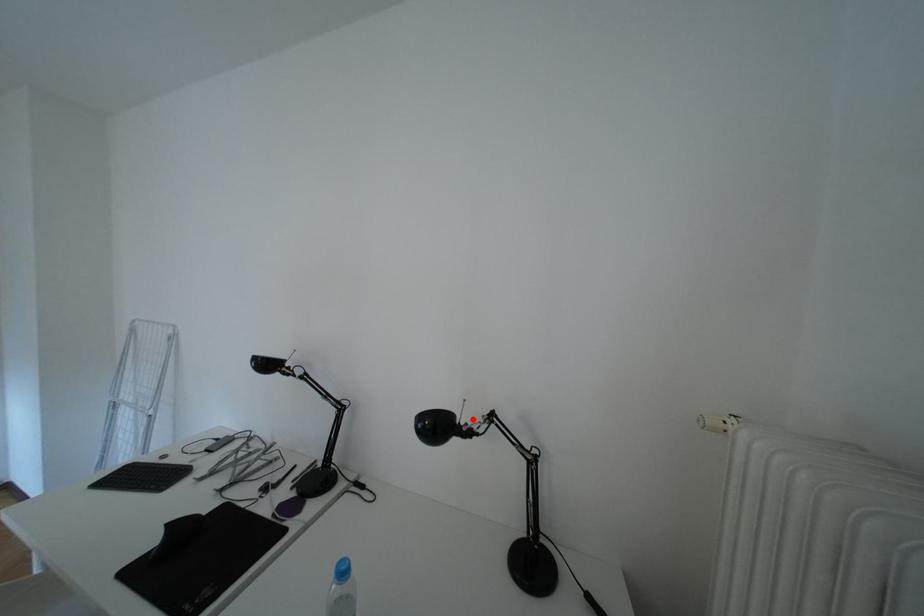
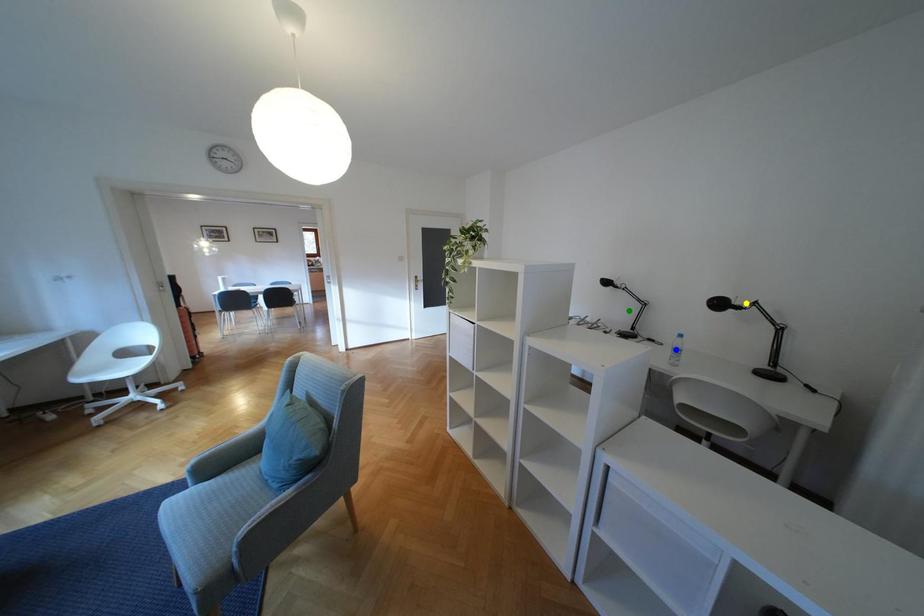
Question: I am providing you with two images of the same scene from different viewpoints. A red point is marked on the first image. You are given multiple points on the second image. Which mark in image 2 goes with the point in image 1?

Choices:
 (A) yellow point
 (B) blue point
 (C) green point

Answer: (A)